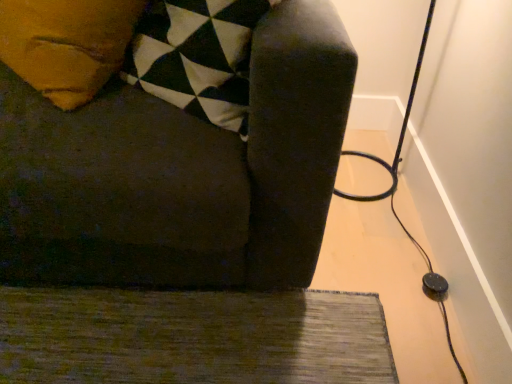
Question: Can you confirm if black rubber cable at right is bigger than green textured rug at lower left?

Choices:
 (A) no
 (B) yes

Answer: (B)

Question: Is black rubber cable at right further to camera compared to green textured rug at lower left?

Choices:
 (A) yes
 (B) no

Answer: (A)

Question: Is black rubber cable at right shorter than green textured rug at lower left?

Choices:
 (A) no
 (B) yes

Answer: (A)

Question: Is black rubber cable at right aimed at green textured rug at lower left?

Choices:
 (A) yes
 (B) no

Answer: (B)

Question: Does black rubber cable at right touch green textured rug at lower left?

Choices:
 (A) no
 (B) yes

Answer: (A)

Question: In terms of width, does green textured rug at lower left look wider or thinner when compared to black rubber cable at right?

Choices:
 (A) thin
 (B) wide

Answer: (B)

Question: Is point (207, 349) closer or farther from the camera than point (440, 289)?

Choices:
 (A) farther
 (B) closer

Answer: (B)

Question: From the image's perspective, is green textured rug at lower left located above or below black rubber cable at right?

Choices:
 (A) below
 (B) above

Answer: (A)

Question: In the image, is green textured rug at lower left positioned in front of or behind black rubber cable at right?

Choices:
 (A) behind
 (B) front

Answer: (B)

Question: Would you say green textured rug at lower left is inside or outside dark fabric couch at center?

Choices:
 (A) outside
 (B) inside

Answer: (A)

Question: In terms of height, does green textured rug at lower left look taller or shorter compared to dark fabric couch at center?

Choices:
 (A) short
 (B) tall

Answer: (A)

Question: From the image's perspective, relative to dark fabric couch at center, is green textured rug at lower left above or below?

Choices:
 (A) above
 (B) below

Answer: (B)

Question: Is point (170, 304) closer or farther from the camera than point (202, 160)?

Choices:
 (A) closer
 (B) farther

Answer: (B)

Question: Does point (108, 139) appear closer or farther from the camera than point (208, 297)?

Choices:
 (A) farther
 (B) closer

Answer: (B)

Question: From a real-world perspective, is dark fabric couch at center positioned above or below green textured rug at lower left?

Choices:
 (A) above
 (B) below

Answer: (A)